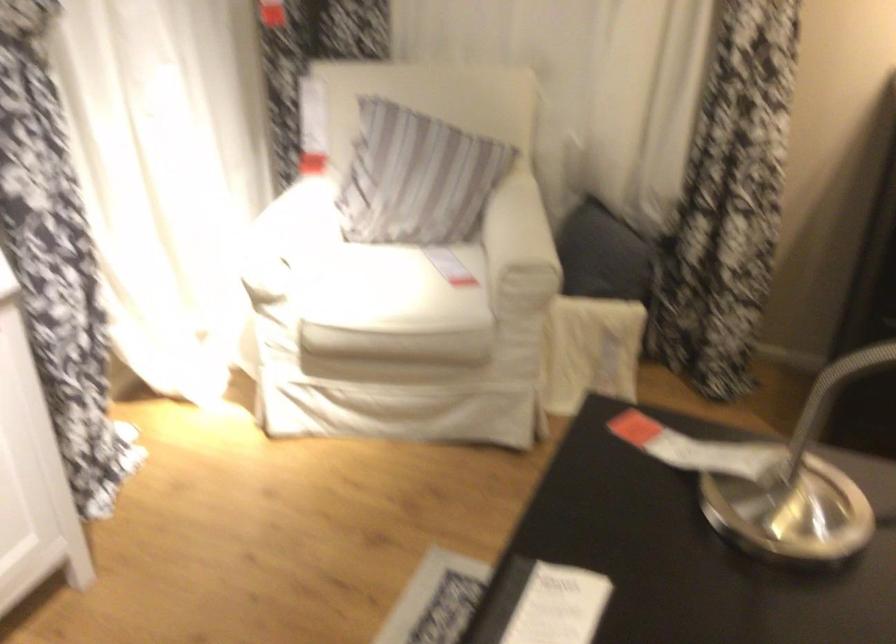
The width and height of the screenshot is (896, 644). Describe the element at coordinates (388, 287) in the screenshot. I see `the chair sitting surface` at that location.